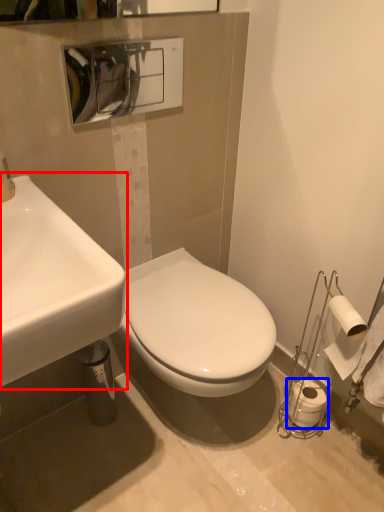
Question: Which object is further to the camera taking this photo, sink (highlighted by a red box) or toilet paper (highlighted by a blue box)?

Choices:
 (A) sink
 (B) toilet paper

Answer: (B)